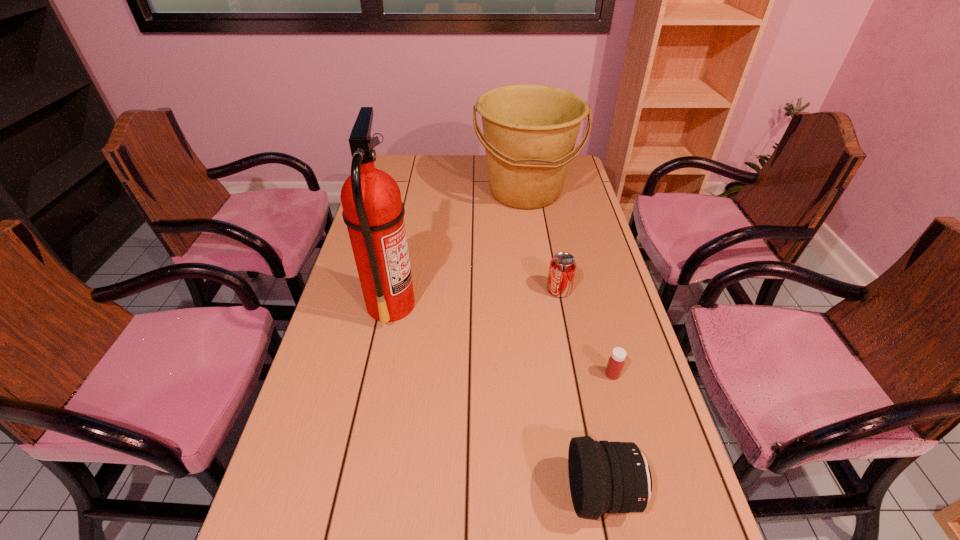
Find the location of a particular element. This screenshot has height=540, width=960. vacant space located on the side of the farthest object with the handle is located at coordinates coord(540,297).

Locate an element on the screen. The height and width of the screenshot is (540, 960). vacant region located at the front element of the telephoto lens is located at coordinates (404, 492).

Locate an element on the screen. The height and width of the screenshot is (540, 960). free location located 0.180m at the front element of the telephoto lens is located at coordinates (480, 492).

Locate an element on the screen. The image size is (960, 540). free space located 0.360m at the front element of the telephoto lens is located at coordinates (389, 492).

You are a GUI agent. You are given a task and a screenshot of the screen. Output one action in this format:
    pyautogui.click(x=<x>, y=<y>)
    Task: Click on the vacant region located on the back of the second shortest object
    This screenshot has width=960, height=540.
    Given the screenshot: What is the action you would take?
    pyautogui.click(x=546, y=225)

Where is `blank space located 0.090m on the front of the medicine`? The image size is (960, 540). blank space located 0.090m on the front of the medicine is located at coordinates (623, 414).

The width and height of the screenshot is (960, 540). I want to click on object positioned at the far edge, so click(x=530, y=130).

Locate an element on the screen. The height and width of the screenshot is (540, 960). object present at the left edge is located at coordinates pos(373,211).

Locate an element on the screen. This screenshot has width=960, height=540. bucket that is at the right edge is located at coordinates (530, 130).

At what (x,y) coordinates should I click in order to perform the action: click on telephoto lens that is positioned at the right edge. Please return your answer as a coordinate pair (x, y). The image size is (960, 540). Looking at the image, I should click on (607, 477).